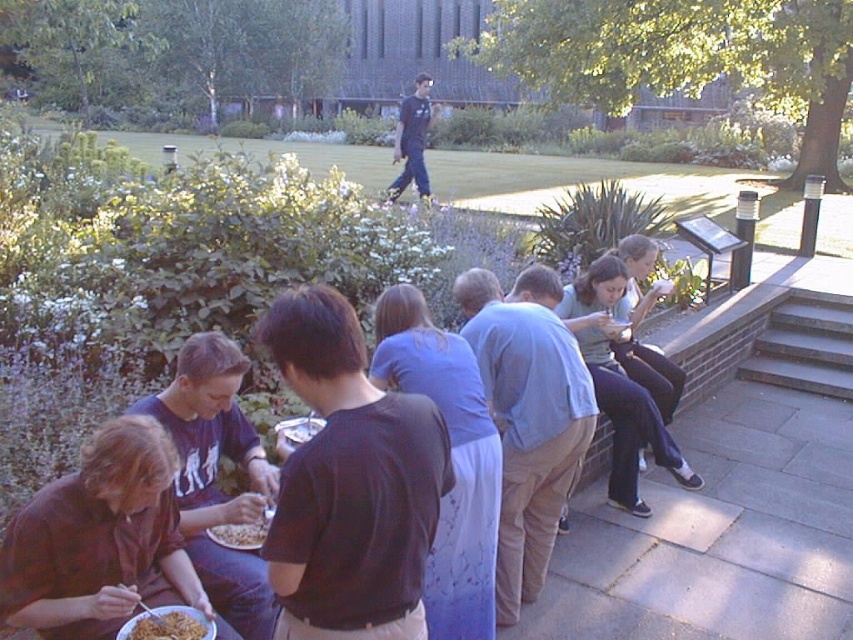
Question: Can you confirm if brown fabric shirt at lower left is wider than smooth white noodles at lower left?

Choices:
 (A) no
 (B) yes

Answer: (B)

Question: Is the position of brown fabric shirt at lower left more distant than that of smooth white noodles at lower left?

Choices:
 (A) no
 (B) yes

Answer: (A)

Question: Which point is farther from the camera taking this photo?

Choices:
 (A) (122, 451)
 (B) (213, 540)
 (C) (117, 636)

Answer: (B)

Question: Can you confirm if golden crispy noodles at lower left is positioned to the left of smooth white noodles at lower left?

Choices:
 (A) no
 (B) yes

Answer: (B)

Question: Which object is farther from the camera taking this photo?

Choices:
 (A) brown fabric shirt at lower left
 (B) smooth white noodles at lower left

Answer: (B)

Question: Which point is closer to the camera?

Choices:
 (A) smooth white noodles at lower left
 (B) brown fabric shirt at lower left

Answer: (B)